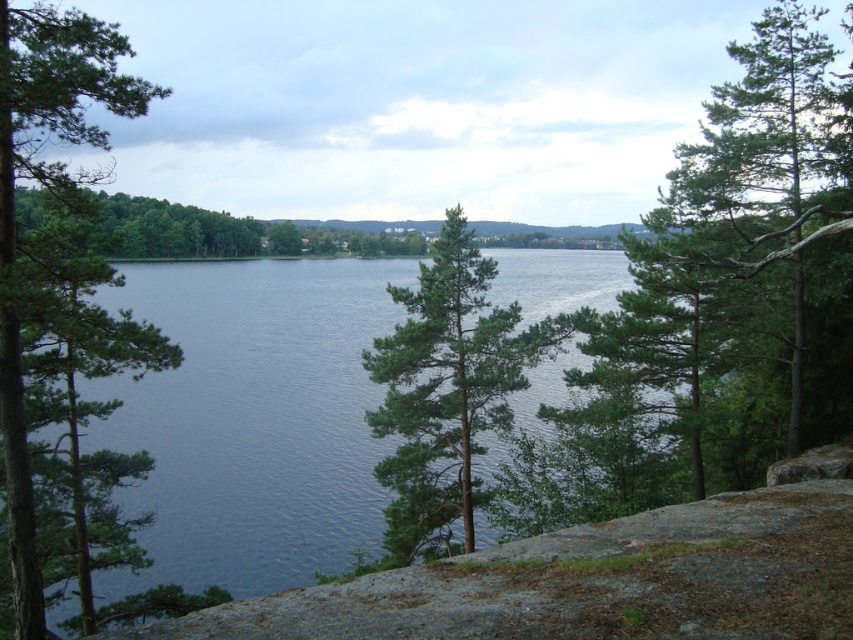
Which of these two, blue water at center or green textured tree at right, stands shorter?

blue water at center is shorter.

From the picture: Can you confirm if blue water at center is positioned below green textured tree at right?

Yes, blue water at center is below green textured tree at right.

Does point (97, 422) come farther from viewer compared to point (746, 195)?

No, (97, 422) is closer to viewer.

Where is `blue water at center`? Image resolution: width=853 pixels, height=640 pixels. blue water at center is located at coordinates (252, 419).

Does blue water at center appear over green matte tree at left?

Yes, blue water at center is above green matte tree at left.

Can you confirm if blue water at center is bigger than green matte tree at left?

Indeed, blue water at center has a larger size compared to green matte tree at left.

Locate an element on the screen. The width and height of the screenshot is (853, 640). blue water at center is located at coordinates (252, 419).

Locate an element on the screen. The width and height of the screenshot is (853, 640). blue water at center is located at coordinates (252, 419).

Is point (293, 436) less distant than point (460, 275)?

No, (293, 436) is further to viewer.

Can you confirm if blue water at center is positioned to the left of green needle-like tree at center?

Incorrect, blue water at center is not on the left side of green needle-like tree at center.

Is point (132, 406) closer to viewer compared to point (450, 404)?

No, (132, 406) is behind (450, 404).

The height and width of the screenshot is (640, 853). Find the location of `blue water at center`. blue water at center is located at coordinates (252, 419).